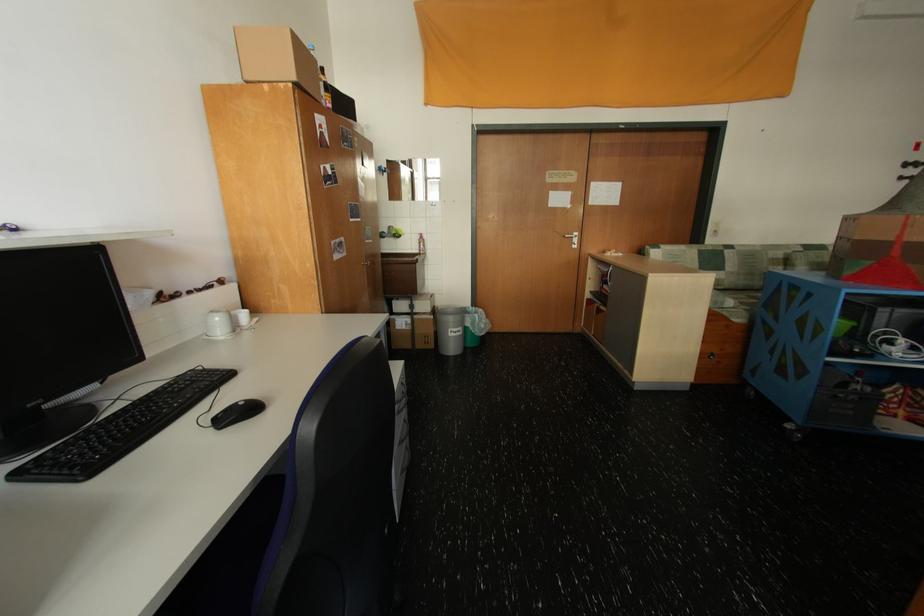
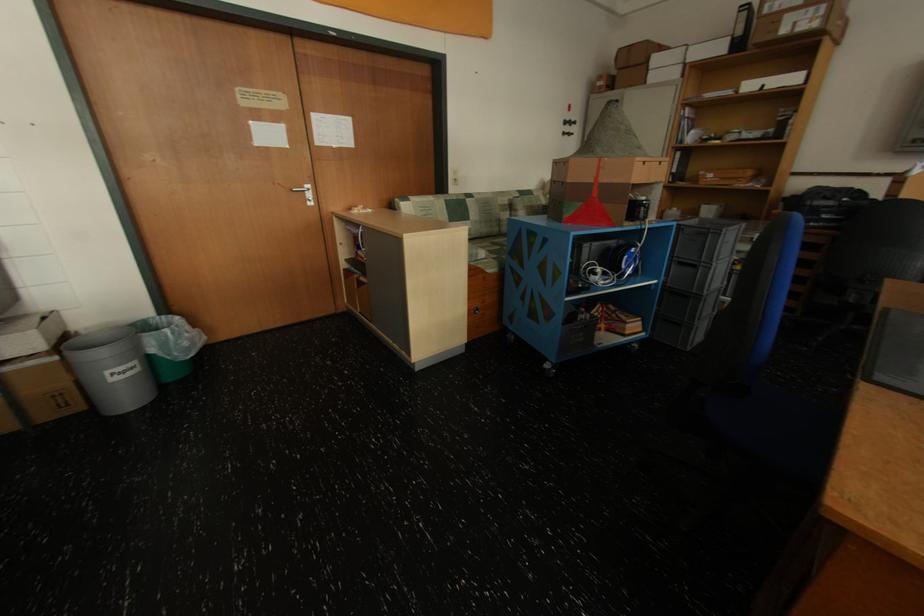
Where in the second image is the point corresponding to point 704,238 from the first image?

(448, 187)